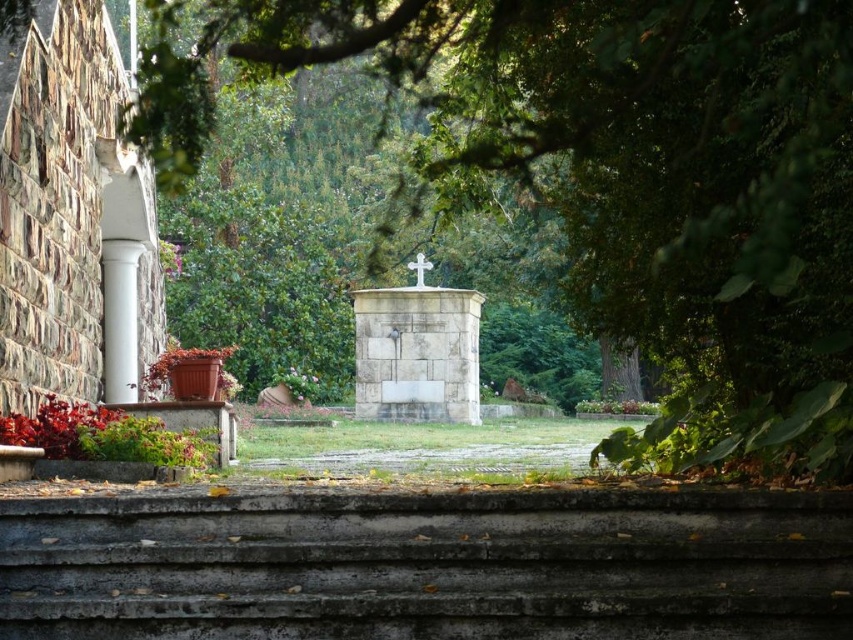
Between green leafy tree at center and concrete steps at center, which one is positioned higher?

green leafy tree at center

Between point (778, 372) and point (631, 522), which one is positioned behind?

Point (778, 372)

Image resolution: width=853 pixels, height=640 pixels. I want to click on green leafy tree at center, so click(x=612, y=173).

Can you confirm if concrete steps at center is thinner than white marble column at left?

No, concrete steps at center is not thinner than white marble column at left.

Does point (308, 616) come in front of point (135, 304)?

Yes, point (308, 616) is in front of point (135, 304).

You are a GUI agent. You are given a task and a screenshot of the screen. Output one action in this format:
    pyautogui.click(x=<x>, y=<y>)
    Task: Click on the concrete steps at center
    This screenshot has width=853, height=640.
    Given the screenshot: What is the action you would take?
    pyautogui.click(x=428, y=564)

Is green leafy tree at center above white marble column at left?

Correct, green leafy tree at center is located above white marble column at left.

What do you see at coordinates (612, 173) in the screenshot? Image resolution: width=853 pixels, height=640 pixels. I see `green leafy tree at center` at bounding box center [612, 173].

You are a GUI agent. You are given a task and a screenshot of the screen. Output one action in this format:
    pyautogui.click(x=<x>, y=<y>)
    Task: Click on the green leafy tree at center
    The image size is (853, 640).
    Given the screenshot: What is the action you would take?
    pyautogui.click(x=612, y=173)